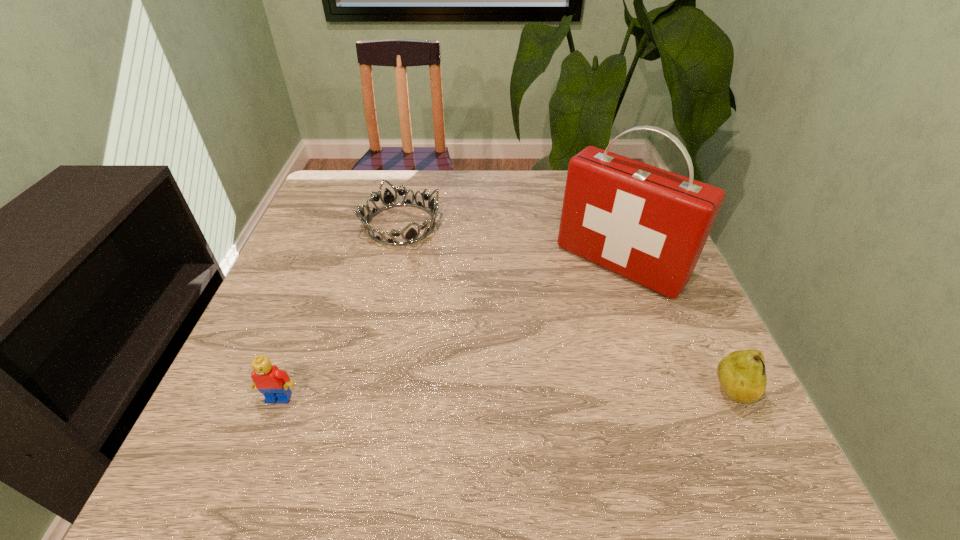
Find the location of `free space on the desktop that is between the leftmost object and the pear and is positioned on the front face of the first-aid kit`. free space on the desktop that is between the leftmost object and the pear and is positioned on the front face of the first-aid kit is located at coordinates (502, 395).

Identify the location of free space on the desktop that is between the leftmost object and the pear and is positioned on the front-facing side of the shortest object. (504, 395).